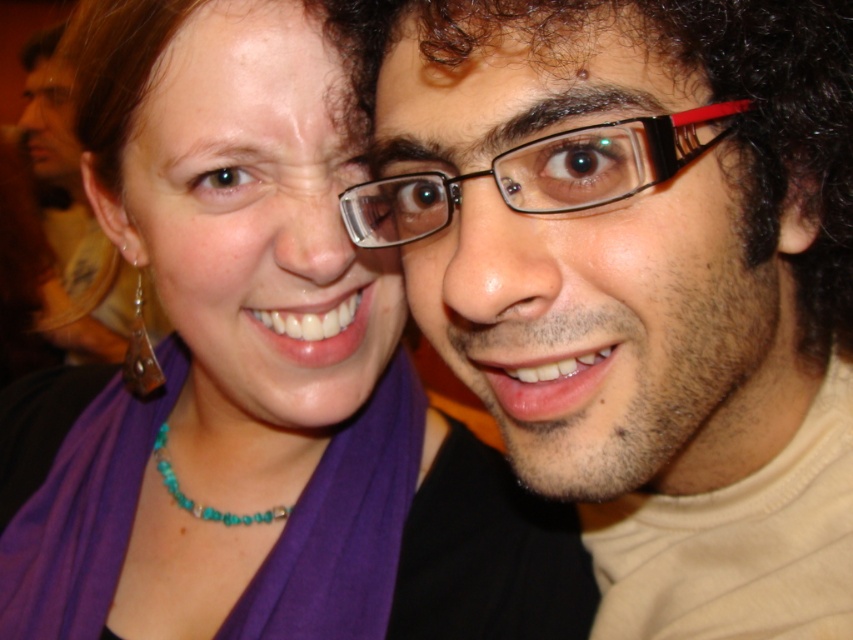
Can you confirm if matte black glasses at center is positioned to the left of black plastic glasses at center?

No, matte black glasses at center is not to the left of black plastic glasses at center.

Is matte black glasses at center smaller than black plastic glasses at center?

Actually, matte black glasses at center might be larger than black plastic glasses at center.

Is point (809, 445) positioned before point (701, 120)?

No, (809, 445) is further to viewer.

Image resolution: width=853 pixels, height=640 pixels. I want to click on matte black glasses at center, so (640, 280).

Between gold metallic earring at left and turquoise beaded necklace at center, which one appears on the left side from the viewer's perspective?

From the viewer's perspective, gold metallic earring at left appears more on the left side.

Is point (129, 336) positioned in front of point (165, 442)?

No, (129, 336) is behind (165, 442).

Is point (142, 298) more distant than point (194, 512)?

No.

Identify the location of gold metallic earring at left. This screenshot has width=853, height=640. 140,353.

Is matte black glasses at center taller than turquoise beaded necklace at center?

Correct, matte black glasses at center is much taller as turquoise beaded necklace at center.

The image size is (853, 640). What do you see at coordinates (640, 280) in the screenshot? I see `matte black glasses at center` at bounding box center [640, 280].

Find the location of a particular element. Image resolution: width=853 pixels, height=640 pixels. matte black glasses at center is located at coordinates (640, 280).